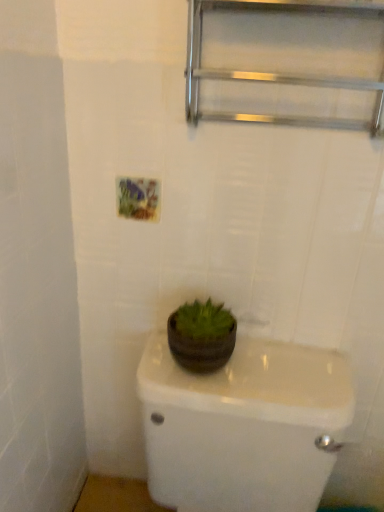
Where is `vacant area that lies to the right of dark brown matte flowerpot at center`? This screenshot has width=384, height=512. vacant area that lies to the right of dark brown matte flowerpot at center is located at coordinates (282, 373).